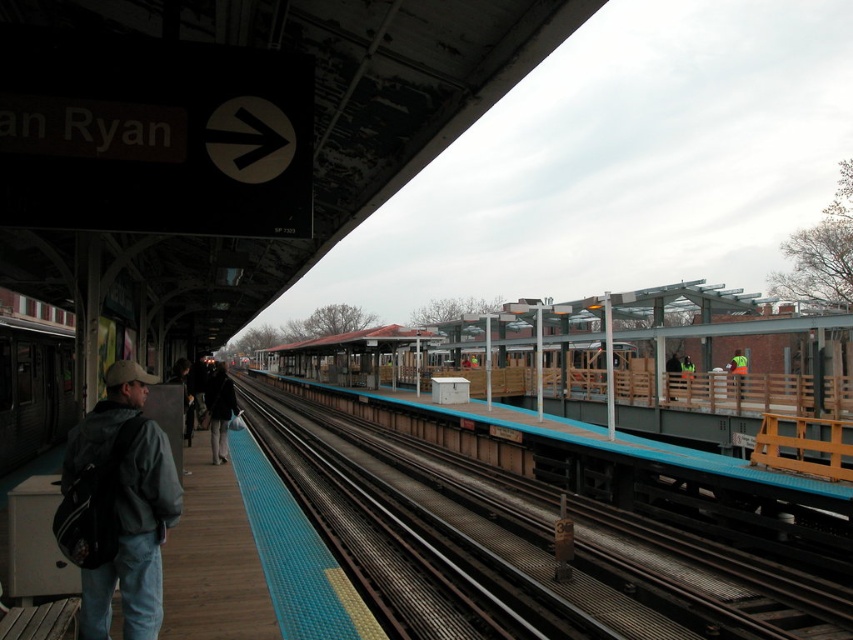
Between smooth concrete track at center and gray fabric jacket at left, which one is positioned lower?

smooth concrete track at center

Between point (640, 544) and point (67, 516), which one is positioned in front?

Point (67, 516) is in front.

Who is more distant from viewer, (288, 397) or (140, 604)?

The point (288, 397) is behind.

Find the location of a particular element. smooth concrete track at center is located at coordinates (706, 579).

In the scene shown: Can you confirm if gray fabric jacket at left is shorter than reflective yellow vest at center?

Incorrect, gray fabric jacket at left's height does not fall short of reflective yellow vest at center's.

Is point (126, 392) farther from viewer compared to point (735, 387)?

That is False.

Is point (120, 538) more distant than point (733, 356)?

No.

Locate an element on the screen. Image resolution: width=853 pixels, height=640 pixels. gray fabric jacket at left is located at coordinates (119, 506).

How distant is gray fabric jacket at left from dark gray jacket at center?

They are 7.40 meters apart.

Is gray fabric jacket at left thinner than dark gray jacket at center?

Yes.

Find the location of a particular element. gray fabric jacket at left is located at coordinates (119, 506).